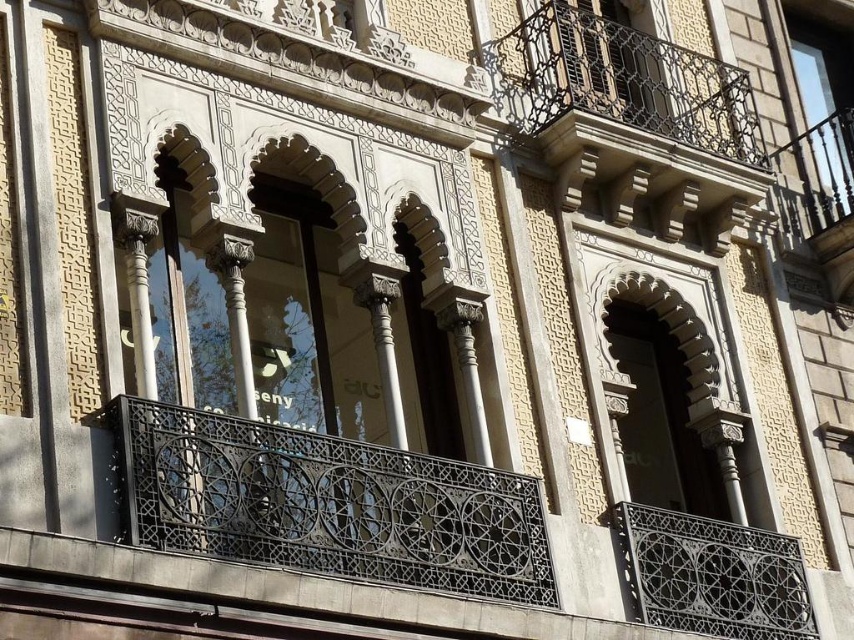
Question: Is dark gray wrought iron at center above black wrought iron balustrade at lower right?

Choices:
 (A) no
 (B) yes

Answer: (B)

Question: Can you confirm if dark gray wrought iron at center is positioned above black wrought iron balustrade at lower right?

Choices:
 (A) yes
 (B) no

Answer: (A)

Question: In this image, where is dark gray wrought iron at center located relative to black wrought iron balustrade at lower right?

Choices:
 (A) below
 (B) above

Answer: (B)

Question: Which point appears closest to the camera in this image?

Choices:
 (A) (744, 584)
 (B) (493, 595)

Answer: (B)

Question: Among these points, which one is farthest from the camera?

Choices:
 (A) (650, 584)
 (B) (322, 557)

Answer: (A)

Question: Among these objects, which one is farthest from the camera?

Choices:
 (A) dark gray wrought iron at center
 (B) black wrought iron balustrade at lower right

Answer: (B)